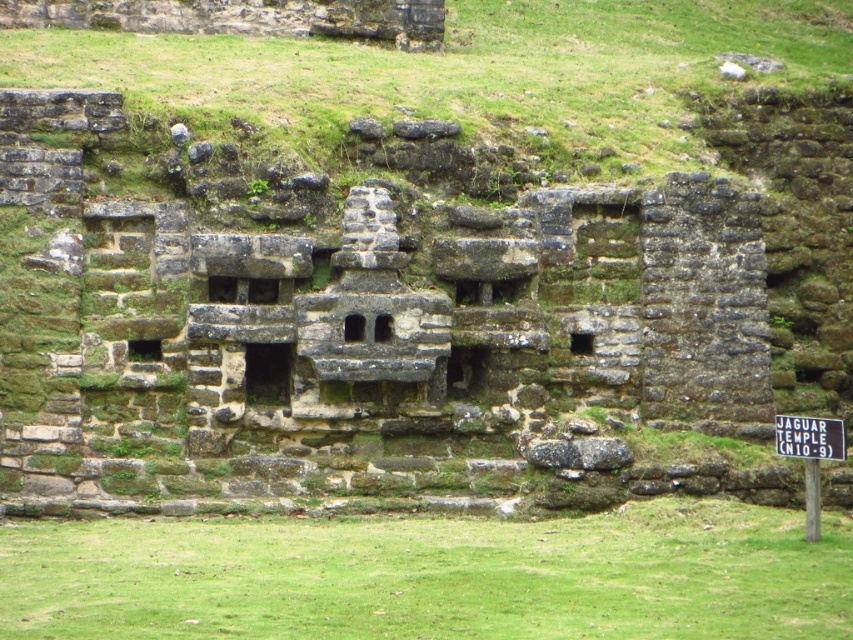
Which is below, green grass at lower center or green mossy wall at upper center?

green grass at lower center

Can you confirm if green grass at lower center is positioned below green mossy wall at upper center?

Yes, green grass at lower center is below green mossy wall at upper center.

Which is behind, point (413, 616) or point (550, 40)?

Point (550, 40)

The width and height of the screenshot is (853, 640). What are the coordinates of `green grass at lower center` in the screenshot? It's located at (433, 576).

Who is higher up, green grass at lower center or black paper sign at center?

Positioned higher is black paper sign at center.

Who is more forward, (287, 557) or (796, 417)?

Point (287, 557)

Which is in front, point (16, 568) or point (807, 438)?

Point (16, 568) is in front.

Identify the location of green grass at lower center. Image resolution: width=853 pixels, height=640 pixels. [433, 576].

Is green mossy wall at upper center to the right of black paper sign at center from the viewer's perspective?

In fact, green mossy wall at upper center is to the left of black paper sign at center.

Between point (236, 97) and point (780, 444), which one is positioned behind?

The point (236, 97) is behind.

Is point (526, 12) positioned after point (816, 451)?

Yes.

You are a GUI agent. You are given a task and a screenshot of the screen. Output one action in this format:
    pyautogui.click(x=<x>, y=<y>)
    Task: Click on the green mossy wall at upper center
    The width and height of the screenshot is (853, 640).
    Given the screenshot: What is the action you would take?
    pyautogui.click(x=463, y=72)